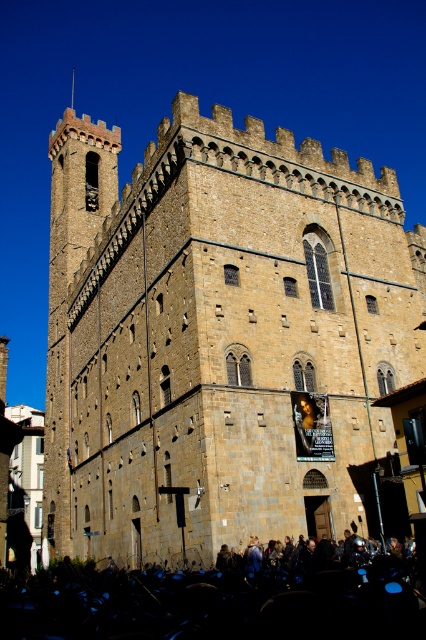
Question: Which point is closer to the camera?

Choices:
 (A) (98, 244)
 (B) (112, 605)

Answer: (B)

Question: In this image, where is brown stone castle at center located relative to black matte crowd at lower center?

Choices:
 (A) right
 (B) left

Answer: (B)

Question: Does brown stone castle at center appear under black matte crowd at lower center?

Choices:
 (A) no
 (B) yes

Answer: (A)

Question: Which of the following is the closest to the observer?

Choices:
 (A) (69, 632)
 (B) (334, 481)

Answer: (A)

Question: Is brown stone castle at center positioned behind black matte crowd at lower center?

Choices:
 (A) no
 (B) yes

Answer: (B)